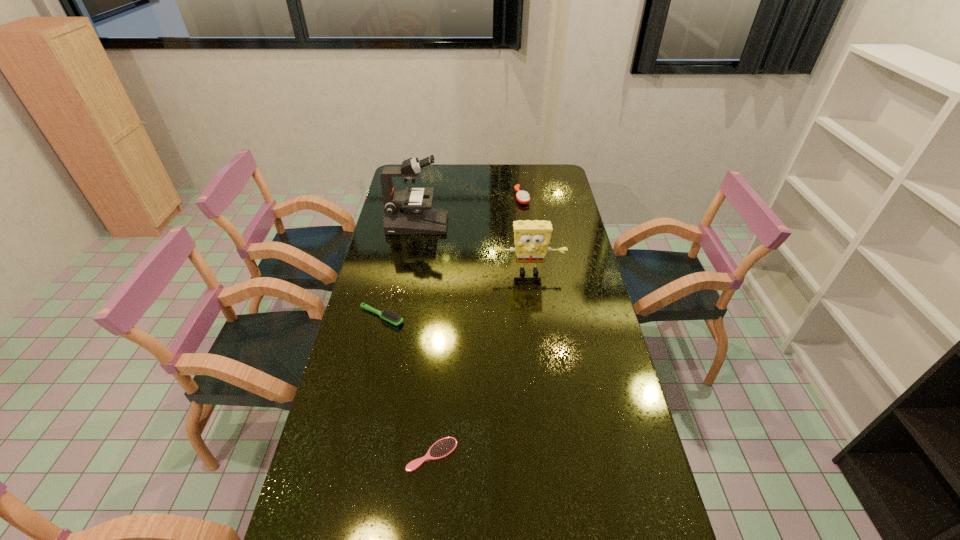
The height and width of the screenshot is (540, 960). I want to click on vacant area at the left edge of the desktop, so click(329, 464).

I want to click on free space at the right edge, so click(x=574, y=234).

Find the location of a particular element. The width and height of the screenshot is (960, 540). free spot at the far right corner of the desktop is located at coordinates (544, 175).

Image resolution: width=960 pixels, height=540 pixels. Find the location of `free space between the rightmost hairbrush and the second nearest object`. free space between the rightmost hairbrush and the second nearest object is located at coordinates (x=452, y=257).

The height and width of the screenshot is (540, 960). What are the coordinates of `empty space that is in between the nearest hairbrush and the fourth farthest object` in the screenshot? It's located at (407, 386).

What are the coordinates of `free space between the rightmost hairbrush and the fourth nearest object` in the screenshot? It's located at (469, 211).

Where is `vacant region between the leftmost hairbrush and the third tallest object`? The width and height of the screenshot is (960, 540). vacant region between the leftmost hairbrush and the third tallest object is located at coordinates (452, 257).

Where is `free spot between the nearest hairbrush and the tallest object`? The height and width of the screenshot is (540, 960). free spot between the nearest hairbrush and the tallest object is located at coordinates (424, 340).

Find the location of a particular element. vacant space that is in between the microscope and the second hairbrush from right to left is located at coordinates (424, 340).

The width and height of the screenshot is (960, 540). Identify the location of vacant space that's between the second hairbrush from right to left and the tallest object. (424, 340).